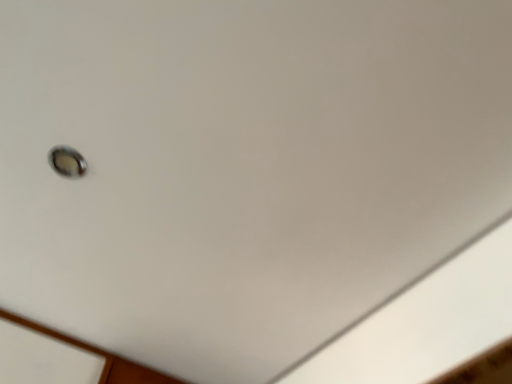
The width and height of the screenshot is (512, 384). What do you see at coordinates (67, 162) in the screenshot?
I see `metallic circular light at upper left` at bounding box center [67, 162].

Measure the distance between point (56, 154) and camera.

Point (56, 154) and camera are 35.98 inches apart.

The width and height of the screenshot is (512, 384). In order to click on metallic circular light at upper left in this screenshot , I will do `click(67, 162)`.

This screenshot has width=512, height=384. Identify the location of metallic circular light at upper left. (67, 162).